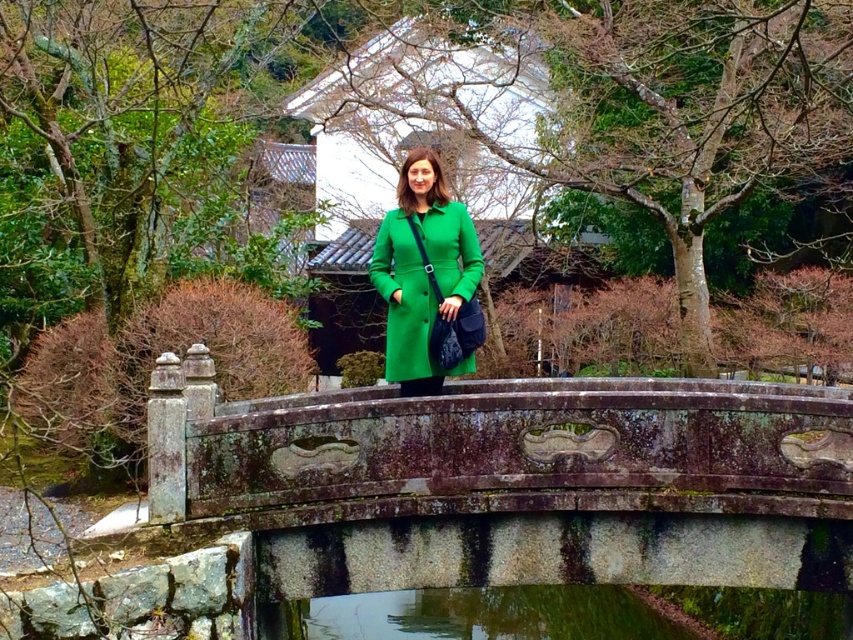
You are a photographer wanting to capture the woman in the green matte coat at center. Since the clear water at bridge center is in front of her, will you need to adjust your camera focus to ensure the woman is in focus?

The clear water at bridge center has a lesser width compared to green matte coat at center, so the woman in the green matte coat at center is further away from the water. Therefore, adjusting the focus to account for the distance between the clear water at bridge center and the woman would ensure she is in focus.

You are a photographer planning to capture the woman in the green matte coat at center and the clear water at bridge center. Which object takes up more area in the image?

The green matte coat at center occupies more space in the image than the clear water at bridge center.